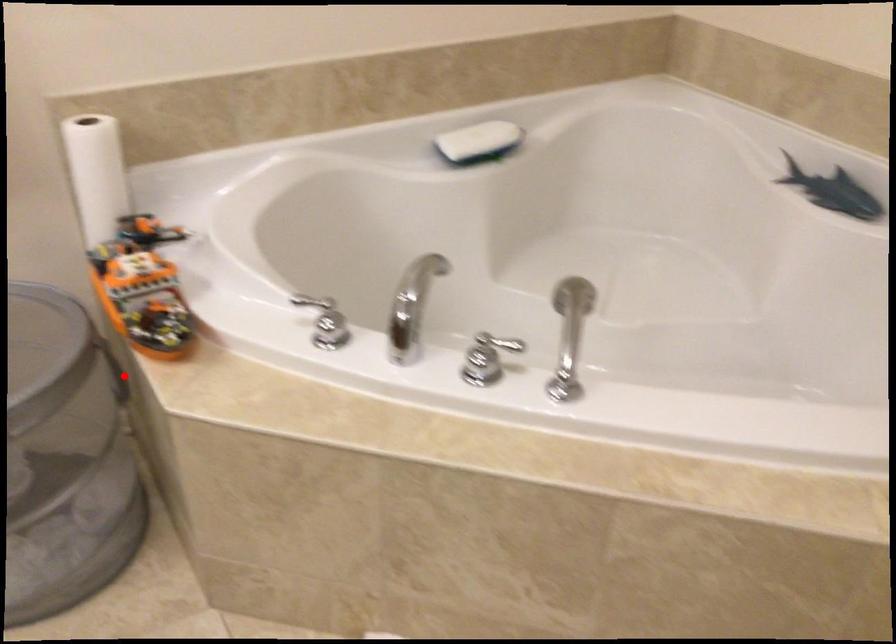
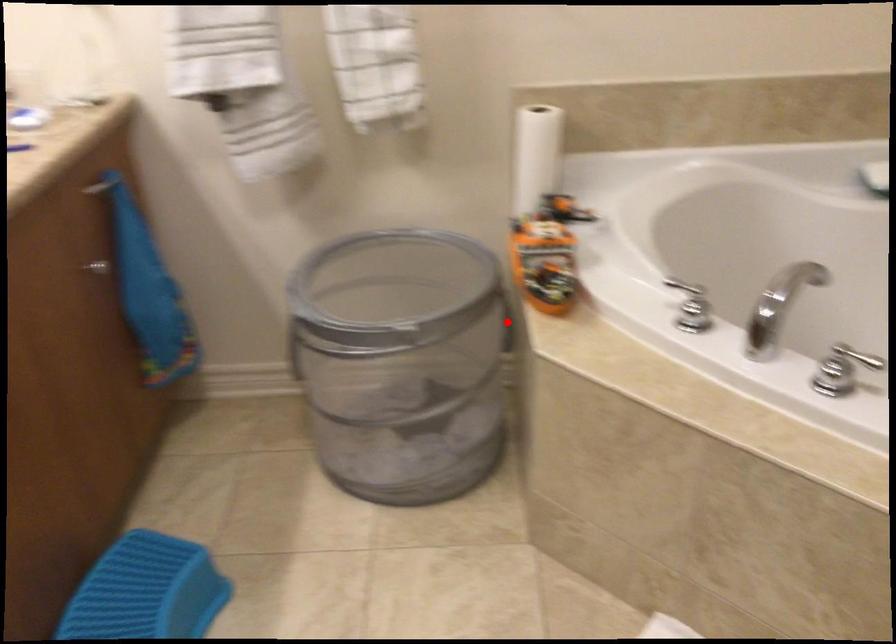
I am providing you with two images of the same scene from different viewpoints. A red point is marked on the first image and another point is marked on the second image. Does the point marked in image1 correspond to the same location as the one in image2?

Yes